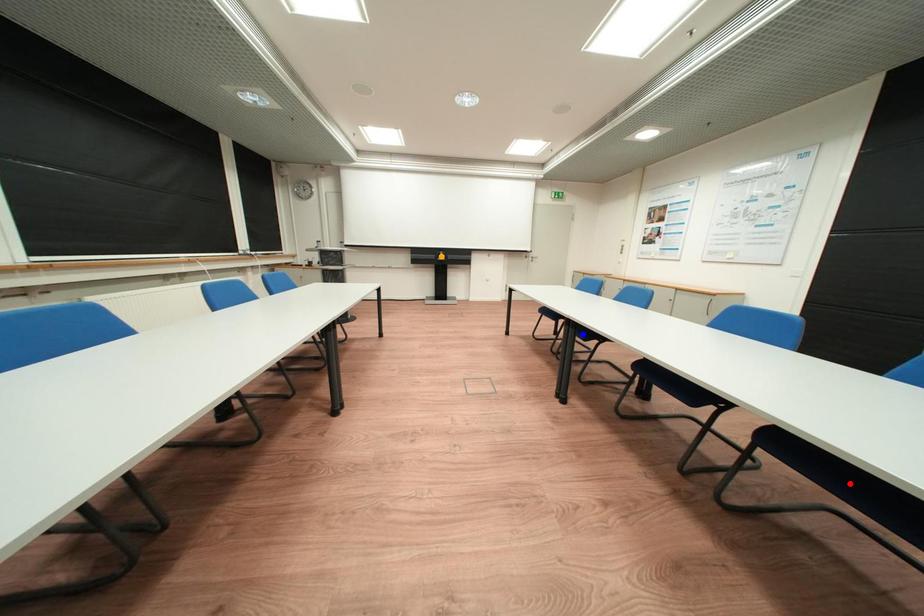
Order these from nearest to farthest:
1. red point
2. orange point
3. blue point

red point → blue point → orange point